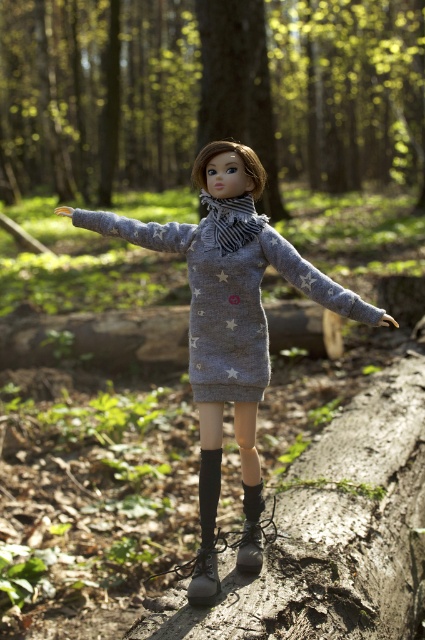
Question: Which of these objects is positioned closest to the brown wood tree trunk at center?

Choices:
 (A) black leather boot at lower center
 (B) striped knit scarf at center
 (C) gray knit dress at center
 (D) gray matte dress at center

Answer: (A)

Question: Is smooth bark log at center below gray matte dress at center?

Choices:
 (A) yes
 (B) no

Answer: (B)

Question: Does gray matte dress at center come behind brown wood tree trunk at center?

Choices:
 (A) no
 (B) yes

Answer: (A)

Question: Is black leather boot at lower center bigger than leather boots at lower center?

Choices:
 (A) no
 (B) yes

Answer: (A)

Question: Among these points, which one is nearest to the camera?

Choices:
 (A) (266, 220)
 (B) (119, 160)
 (C) (350, 308)
 (D) (257, 276)

Answer: (C)

Question: Which point appears farthest from the camera in this image?

Choices:
 (A) (291, 259)
 (B) (346, 145)

Answer: (B)